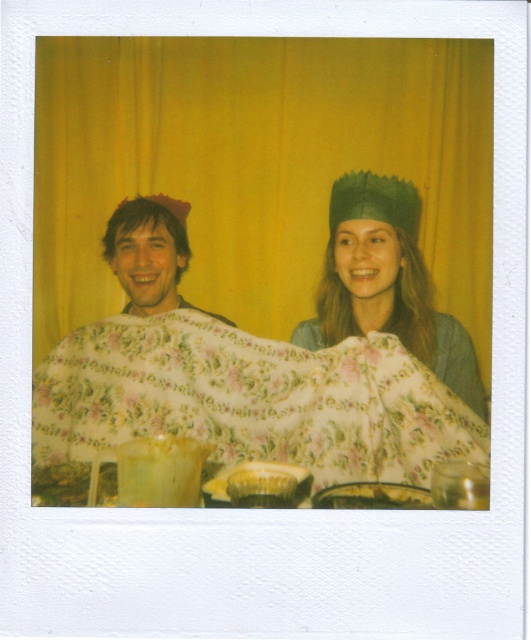
You are standing in front of the Polaroid photograph described. You want to place a small sticker exactly at the point labeled point (x=369, y=280). If your hand can reach up to 1.5 meters, will you be able to reach that point?

The point (x=369, y=280) and viewer are 1.78 meters apart from each other. Since your hand can only reach up to 1.5 meters, you will not be able to reach the point labeled point (x=369, y=280).

You are standing 5 feet away from the floral cotton blanket at center in the image. Can you reach it without moving your feet?

The floral cotton blanket at center is 4.30 feet away from the viewer. Since you are standing 5 feet away, you cannot reach it without moving closer.

Looking at this image, you are a photographer standing in front of the camera. You want to adjust the position of the matte floral blanket at left so that it is closer to the camera than it currently is. How much closer do you need to move it?

The matte floral blanket at left is currently 6.39 feet from the camera. To move it closer, you need to reduce its distance to less than 6.39 feet.